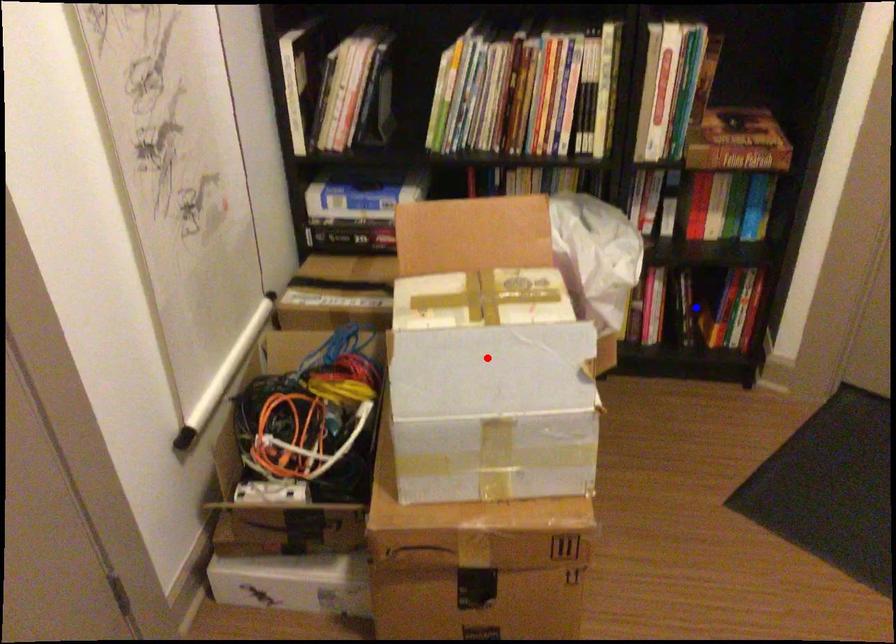
Question: Two points are marked on the image. Which point is closer to the camera?

Choices:
 (A) Blue point is closer.
 (B) Red point is closer.

Answer: (B)